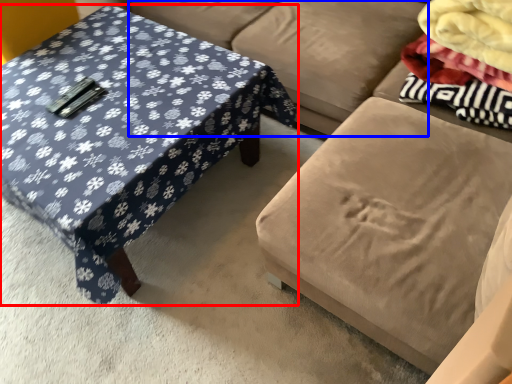
Question: Which object is further to the camera taking this photo, coffee table (highlighted by a red box) or couch (highlighted by a blue box)?

Choices:
 (A) coffee table
 (B) couch

Answer: (B)